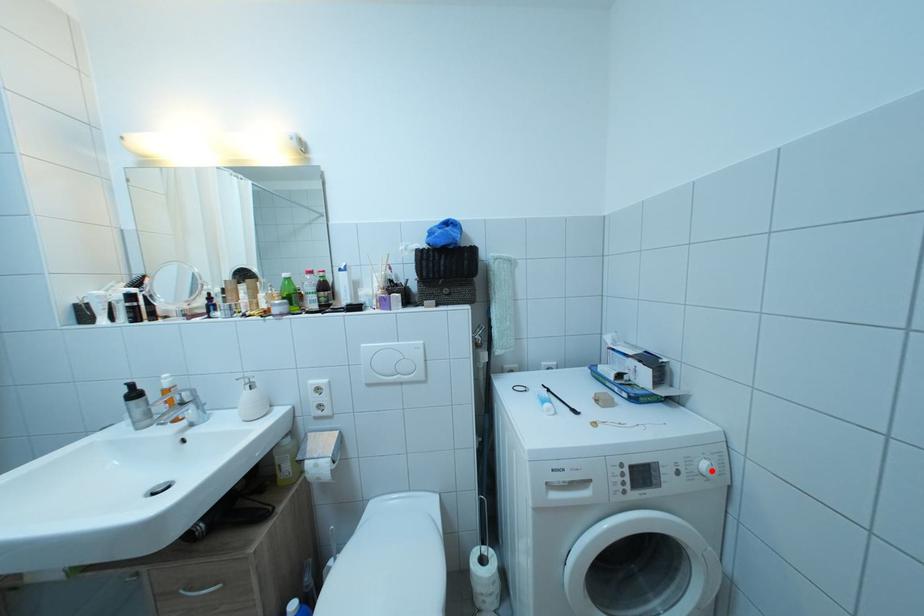
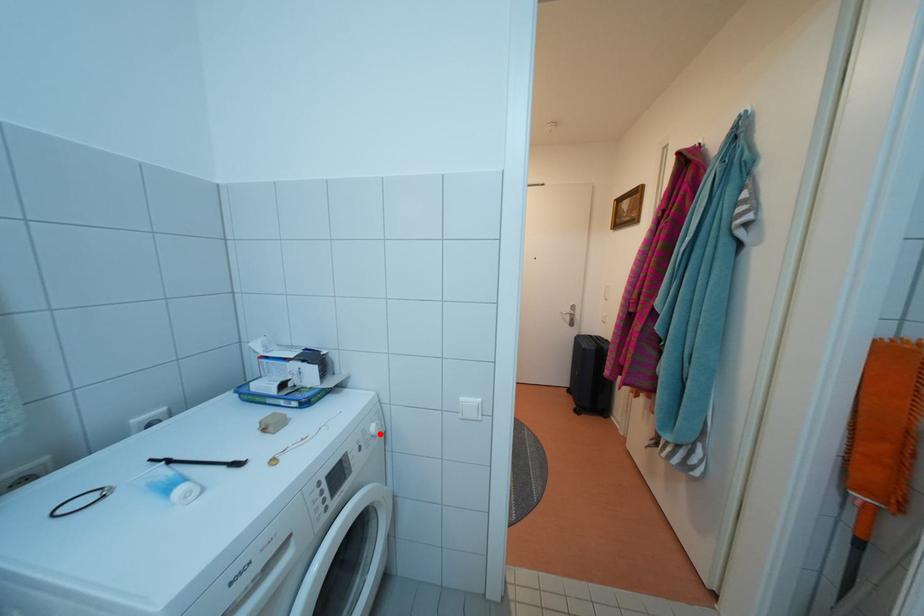
I am providing you with two images of the same scene from different viewpoints. A red point is marked on the first image and another point is marked on the second image. Do the highlighted points in image1 and image2 indicate the same real-world spot?

Yes